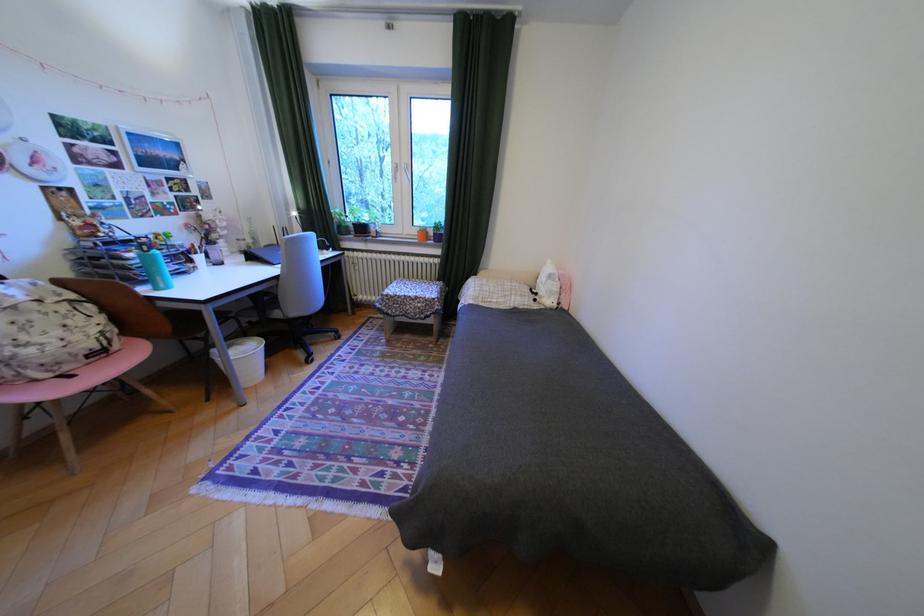
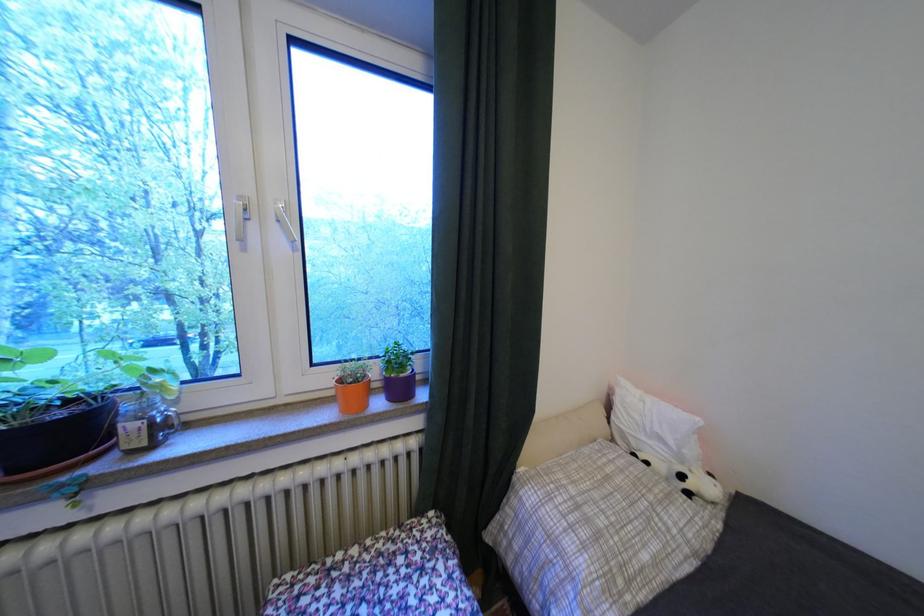
In the second image, find the point that corresponds to pixel 383 225 in the first image.

(138, 408)